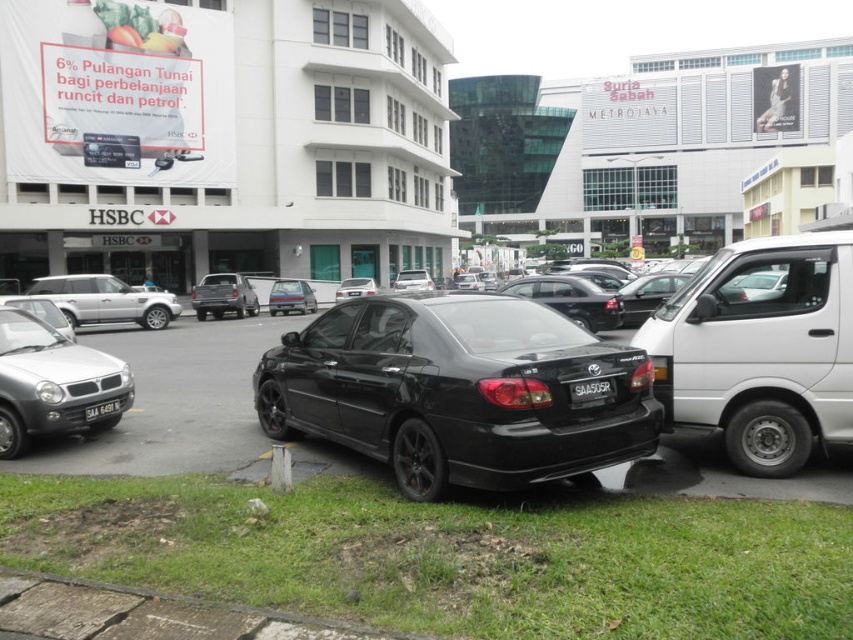
Which is behind, point (376, 444) or point (369, 285)?

Point (369, 285)

Find the location of a particular element. The image size is (853, 640). satin black sedan at center is located at coordinates (457, 390).

Between silver metallic hatchback at left and satin silver suv at center, which one is positioned lower?

silver metallic hatchback at left is below.

Which is behind, point (96, 392) or point (238, 305)?

The point (238, 305) is behind.

Where is `silver metallic hatchback at left`? silver metallic hatchback at left is located at coordinates (51, 381).

Is silver metallic hatchback at left wider than metallic silver sedan at center?

No, silver metallic hatchback at left is not wider than metallic silver sedan at center.

Is silver metallic hatchback at left positioned before metallic silver sedan at center?

That is True.

The height and width of the screenshot is (640, 853). Find the location of `silver metallic hatchback at left`. silver metallic hatchback at left is located at coordinates (51, 381).

This screenshot has width=853, height=640. Identify the location of silver metallic hatchback at left. (51, 381).